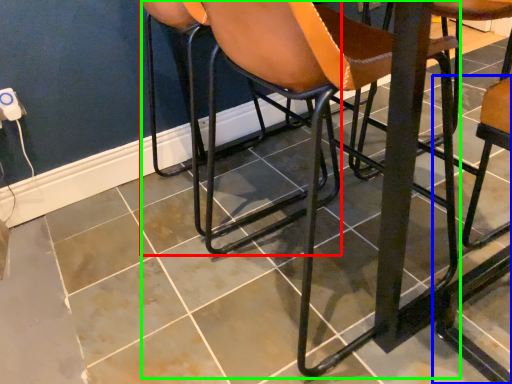
Question: Based on their relative distances, which object is farther from chair (highlighted by a red box)? Choose from chair (highlighted by a blue box) and chair (highlighted by a green box).

Choices:
 (A) chair
 (B) chair

Answer: (A)